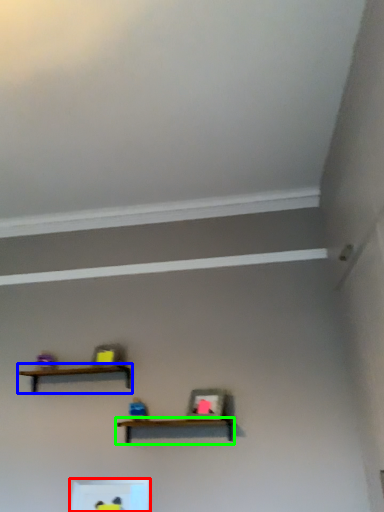
Question: Considering the real-world distances, which object is farthest from shelf (highlighted by a red box)? shelf (highlighted by a blue box) or shelf (highlighted by a green box)?

Choices:
 (A) shelf
 (B) shelf

Answer: (A)